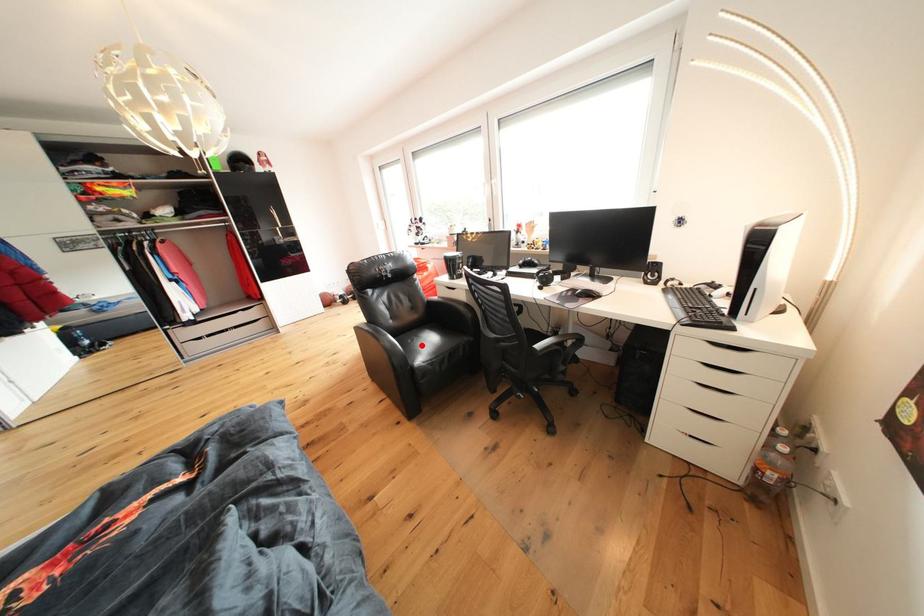
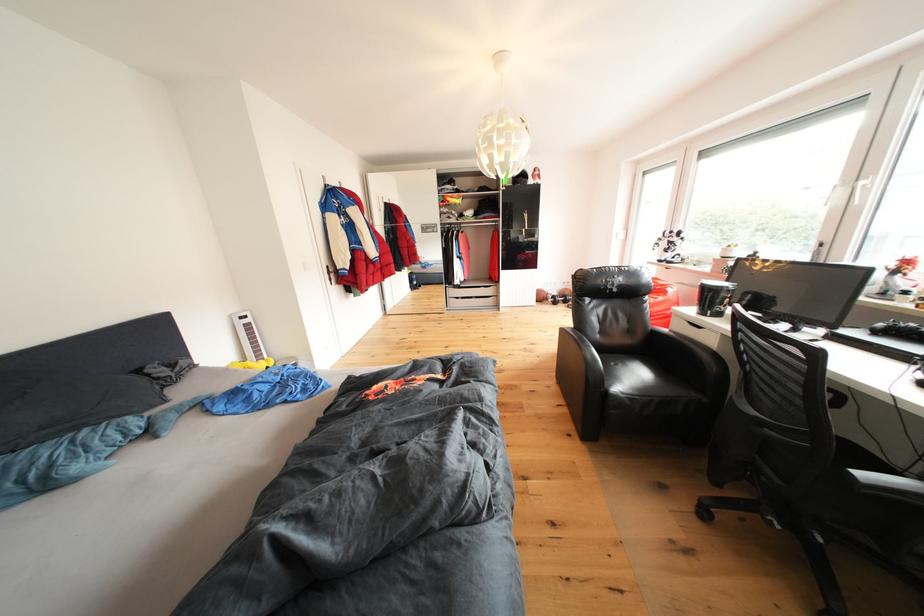
Where in the second image is the point corresponding to the highlighted location from the first image?

(625, 370)